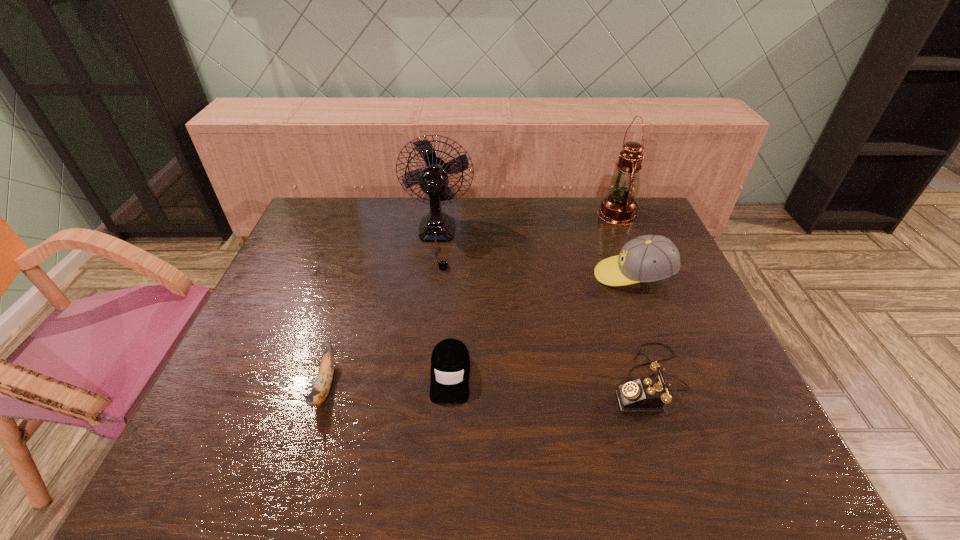
Identify the location of telephone present at the right edge. (647, 395).

Locate an element on the screen. The height and width of the screenshot is (540, 960). object that is at the far right corner is located at coordinates (619, 207).

In the image, there is a desktop. Where is `vacant space at the far edge`? This screenshot has width=960, height=540. vacant space at the far edge is located at coordinates (400, 214).

You are a GUI agent. You are given a task and a screenshot of the screen. Output one action in this format:
    pyautogui.click(x=<x>, y=<y>)
    Task: Click on the free region at the near edge of the desktop
    The image size is (960, 540).
    Given the screenshot: What is the action you would take?
    point(616,466)

I want to click on free space at the left edge, so click(x=232, y=435).

In the image, there is a desktop. Where is `free space at the right edge`? Image resolution: width=960 pixels, height=540 pixels. free space at the right edge is located at coordinates (715, 333).

The height and width of the screenshot is (540, 960). In the image, there is a desktop. Find the location of `vacant area at the far right corner`. vacant area at the far right corner is located at coordinates (622, 237).

At what (x,y) coordinates should I click in order to perform the action: click on blank region between the telephone and the leftmost object. Please return your answer as a coordinate pair (x, y). The image size is (960, 540). Looking at the image, I should click on (487, 383).

The height and width of the screenshot is (540, 960). Identify the location of vacant area that lies between the shortest object and the telephone. (549, 377).

Where is `free space between the fan and the baseball cap`? The width and height of the screenshot is (960, 540). free space between the fan and the baseball cap is located at coordinates (535, 257).